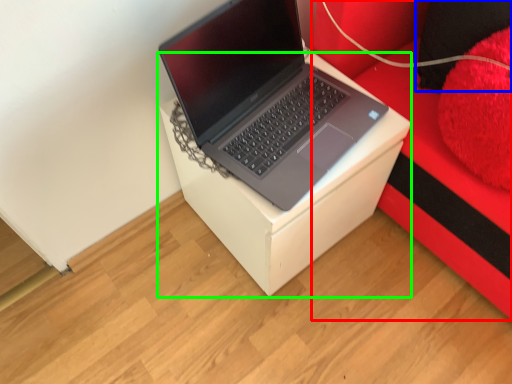
Question: Which is nearer to the furniture (highlighted by a red box)? pillow (highlighted by a blue box) or table (highlighted by a green box).

Choices:
 (A) pillow
 (B) table

Answer: (A)